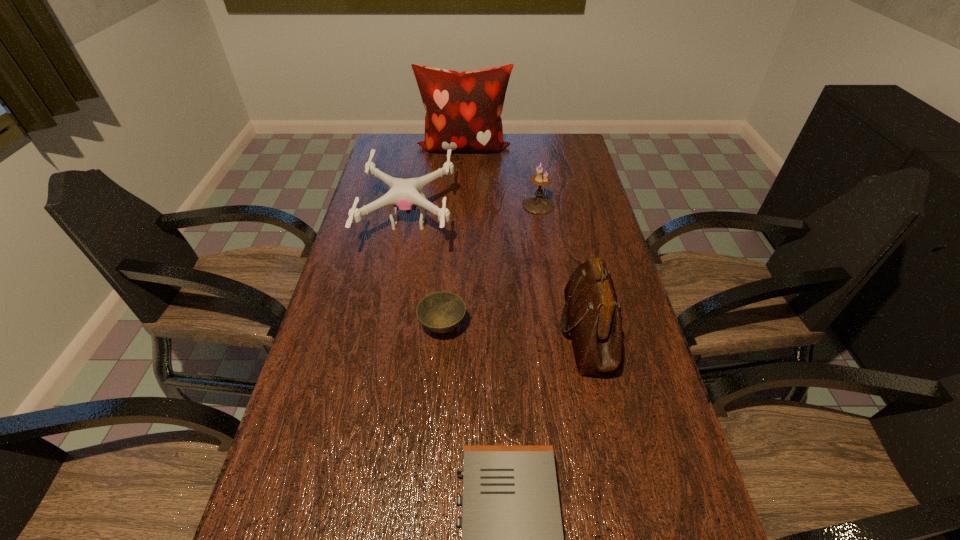
At what (x,y) coordinates should I click in order to perform the action: click on free space between the second tallest object and the bowl. Please return your answer as a coordinate pair (x, y). Looking at the image, I should click on (516, 329).

Image resolution: width=960 pixels, height=540 pixels. In order to click on vacant space in between the drone and the second tallest object in this screenshot , I will do `click(499, 276)`.

Locate an element on the screen. Image resolution: width=960 pixels, height=540 pixels. vacant area that lies between the drone and the bowl is located at coordinates (426, 275).

At what (x,y) coordinates should I click in order to perform the action: click on unoccupied area between the bowl and the farthest object. Please return your answer as a coordinate pair (x, y). The image size is (960, 540). Looking at the image, I should click on (453, 238).

What are the coordinates of `free space between the candle holder and the tallest object` in the screenshot? It's located at (501, 176).

Select which object is the fifth closest to the second tallest object. Please provide its 2D coordinates. Your answer should be formatted as a tuple, i.e. [(x, y)], where the tuple contains the x and y coordinates of a point satisfying the conditions above.

[(463, 109)]

Find the location of `the closest object to the candle holder`. the closest object to the candle holder is located at coordinates (404, 194).

This screenshot has height=540, width=960. I want to click on blank area in the image that satisfies the following two spatial constraints: 1. on the front side of the bowl; 2. on the right side of the second tallest object, so click(443, 331).

Locate an element on the screen. The image size is (960, 540). vacant space that satisfies the following two spatial constraints: 1. on the front-facing side of the farthest object; 2. on the left side of the fifth shortest object is located at coordinates (454, 331).

Image resolution: width=960 pixels, height=540 pixels. Identify the location of blank space that satisfies the following two spatial constraints: 1. on the top of the drone; 2. on the back side of the second tallest object. (389, 331).